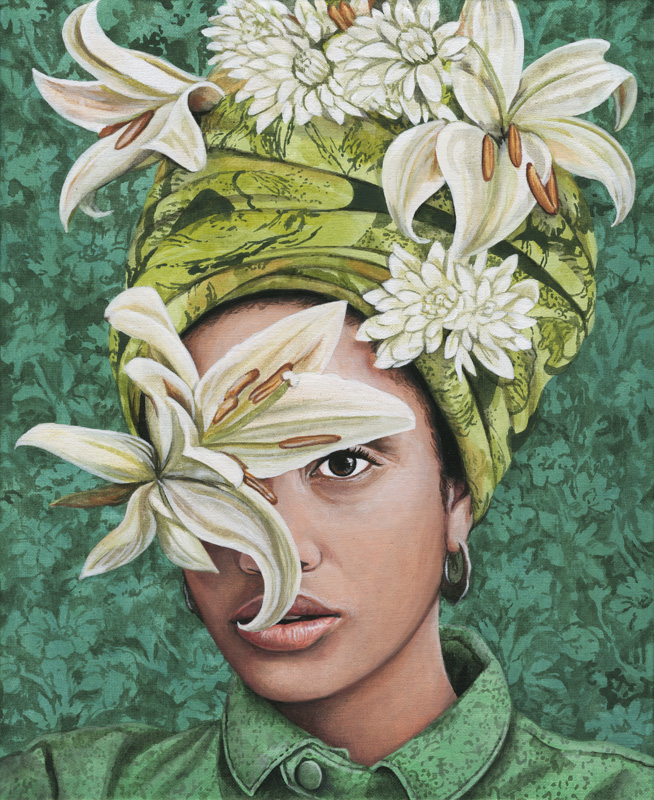
Where is `cloth`? The height and width of the screenshot is (800, 654). cloth is located at coordinates (297, 238).